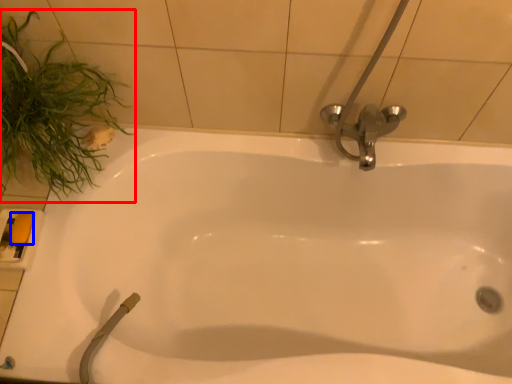
Question: Among these objects, which one is farthest to the camera, plant (highlighted by a red box) or soap (highlighted by a blue box)?

Choices:
 (A) plant
 (B) soap

Answer: (B)